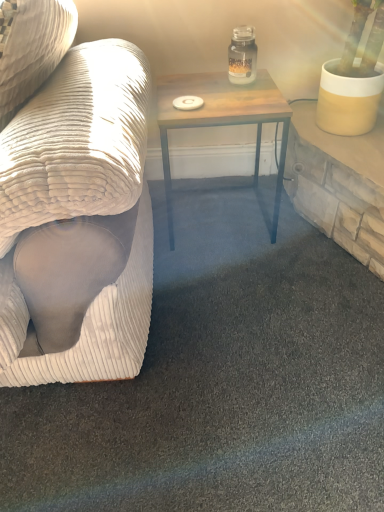
This screenshot has width=384, height=512. What are the coordinates of `free space above wooden table at center (from a real-world perspective)` in the screenshot? It's located at (219, 89).